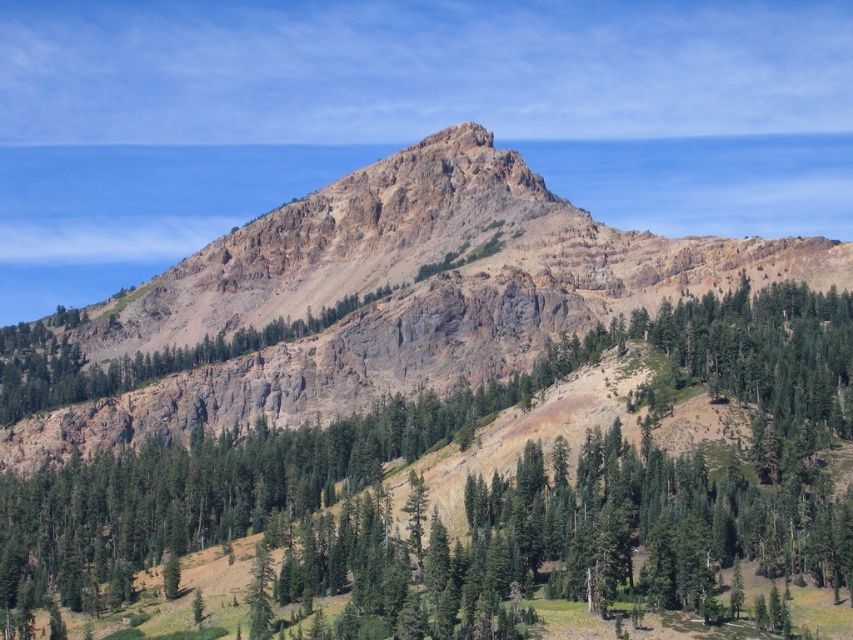
Question: In this image, where is green textured tree at upper center located relative to rugged rock mountain at center?

Choices:
 (A) right
 (B) left

Answer: (A)

Question: Among these points, which one is nearest to the camera?

Choices:
 (A) (155, 301)
 (B) (30, 524)

Answer: (B)

Question: Where is green textured tree at upper center located in relation to rugged rock mountain at center in the image?

Choices:
 (A) above
 (B) below

Answer: (B)

Question: Can you confirm if green textured tree at upper center is positioned to the right of rugged rock mountain at center?

Choices:
 (A) no
 (B) yes

Answer: (B)

Question: Which point is closer to the camera?

Choices:
 (A) green textured tree at upper center
 (B) rugged rock mountain at center

Answer: (A)